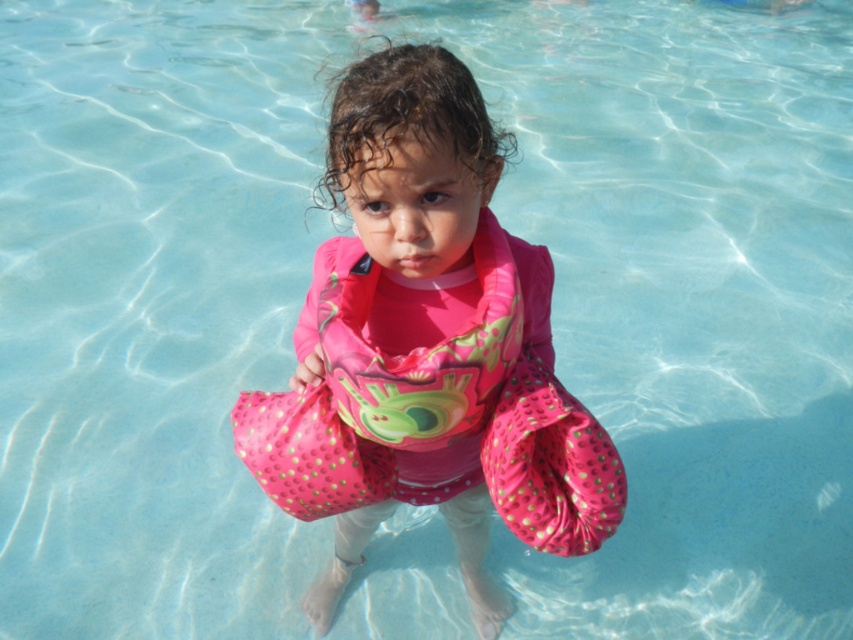
In the scene shown: Does pink fabric floaties at center appear over pink fabric life jacket at center?

No.

Which is above, pink fabric floaties at center or pink fabric life jacket at center?

Positioned higher is pink fabric life jacket at center.

Is point (323, 266) behind point (368, 360)?

Yes, point (323, 266) is farther from viewer.

The height and width of the screenshot is (640, 853). Find the location of `pink fabric floaties at center`. pink fabric floaties at center is located at coordinates (427, 348).